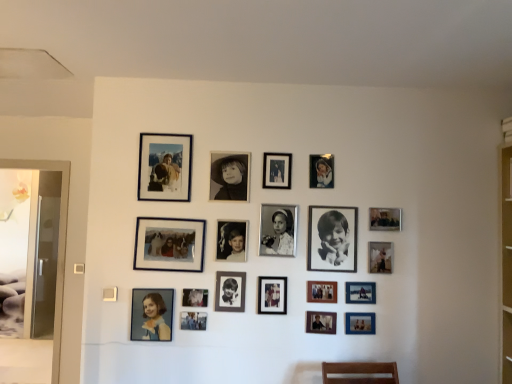
Question: From the image's perspective, is metallic silver photo frame at upper right, the eighteenth picture frame positioned from the left, located above metallic silver photo frame at lower center, which appears as the fourth picture frame when viewed from the left?

Choices:
 (A) yes
 (B) no

Answer: (A)

Question: Considering the relative sizes of metallic silver photo frame at upper right, the 1th picture frame viewed from the right, and metallic silver photo frame at lower center, which appears as the fourth picture frame when viewed from the left, in the image provided, is metallic silver photo frame at upper right, the 1th picture frame viewed from the right, taller than metallic silver photo frame at lower center, which appears as the fourth picture frame when viewed from the left,?

Choices:
 (A) no
 (B) yes

Answer: (B)

Question: Does metallic silver photo frame at upper right, the eighteenth picture frame positioned from the left, have a lesser width compared to metallic silver photo frame at lower center, which is the 15th picture frame in right-to-left order?

Choices:
 (A) no
 (B) yes

Answer: (A)

Question: From a real-world perspective, is metallic silver photo frame at upper right, the eighteenth picture frame positioned from the left, positioned over metallic silver photo frame at lower center, which appears as the fourth picture frame when viewed from the left, based on gravity?

Choices:
 (A) yes
 (B) no

Answer: (A)

Question: From the image's perspective, is metallic silver photo frame at upper right, the 1th picture frame viewed from the right, beneath metallic silver photo frame at lower center, which is the 15th picture frame in right-to-left order?

Choices:
 (A) yes
 (B) no

Answer: (B)

Question: Can we say metallic silver photo frame at upper right, the eighteenth picture frame positioned from the left, lies outside metallic silver photo frame at lower center, which is the 15th picture frame in right-to-left order?

Choices:
 (A) no
 (B) yes

Answer: (B)

Question: Can we say matte blue photo frame at lower right, positioned as the 3th picture frame in right-to-left order, lies outside matte black portrait at lower left, the eighteenth picture frame in the right-to-left sequence?

Choices:
 (A) no
 (B) yes

Answer: (B)

Question: From a real-world perspective, is matte blue photo frame at lower right, positioned as the 3th picture frame in right-to-left order, below matte black portrait at lower left, positioned as the first picture frame in left-to-right order?

Choices:
 (A) no
 (B) yes

Answer: (B)

Question: From a real-world perspective, is matte blue photo frame at lower right, positioned as the 3th picture frame in right-to-left order, on matte black portrait at lower left, positioned as the first picture frame in left-to-right order?

Choices:
 (A) no
 (B) yes

Answer: (A)

Question: From the image's perspective, does matte blue photo frame at lower right, positioned as the sixteenth picture frame in left-to-right order, appear higher than matte black portrait at lower left, positioned as the first picture frame in left-to-right order?

Choices:
 (A) no
 (B) yes

Answer: (A)

Question: Considering the relative positions of matte blue photo frame at lower right, positioned as the 3th picture frame in right-to-left order, and matte black portrait at lower left, positioned as the first picture frame in left-to-right order, in the image provided, is matte blue photo frame at lower right, positioned as the 3th picture frame in right-to-left order, in front of matte black portrait at lower left, positioned as the first picture frame in left-to-right order,?

Choices:
 (A) yes
 (B) no

Answer: (B)

Question: Is matte blue photo frame at lower right, positioned as the sixteenth picture frame in left-to-right order, bigger than matte black portrait at lower left, positioned as the first picture frame in left-to-right order?

Choices:
 (A) yes
 (B) no

Answer: (B)

Question: Is metallic silver photo frame at center-right, positioned as the 2th picture frame in right-to-left order, to the right of metallic silver photo frame at lower center, which is counted as the 12th picture frame, starting from the left, from the viewer's perspective?

Choices:
 (A) no
 (B) yes

Answer: (B)